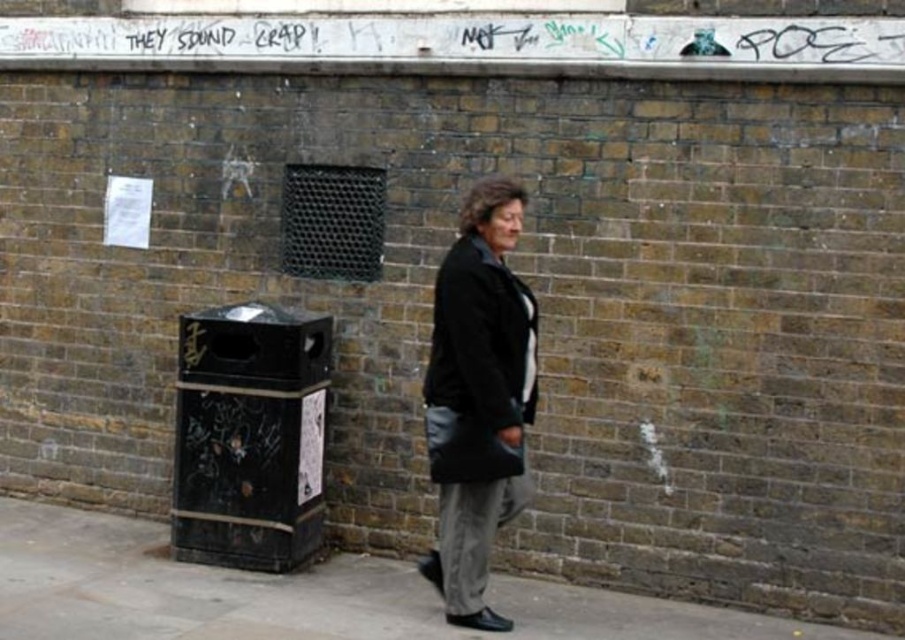
Question: Which object appears closest to the camera in this image?

Choices:
 (A) black leather jacket at center
 (B) gray concrete pavement at lower center

Answer: (B)

Question: Does gray concrete pavement at lower center appear under black leather jacket at center?

Choices:
 (A) no
 (B) yes

Answer: (B)

Question: Considering the relative positions of gray concrete pavement at lower center and black leather jacket at center in the image provided, where is gray concrete pavement at lower center located with respect to black leather jacket at center?

Choices:
 (A) above
 (B) below

Answer: (B)

Question: Can you confirm if gray concrete pavement at lower center is bigger than black leather jacket at center?

Choices:
 (A) no
 (B) yes

Answer: (B)

Question: Which of the following is the farthest from the observer?

Choices:
 (A) (289, 621)
 (B) (441, 472)

Answer: (A)